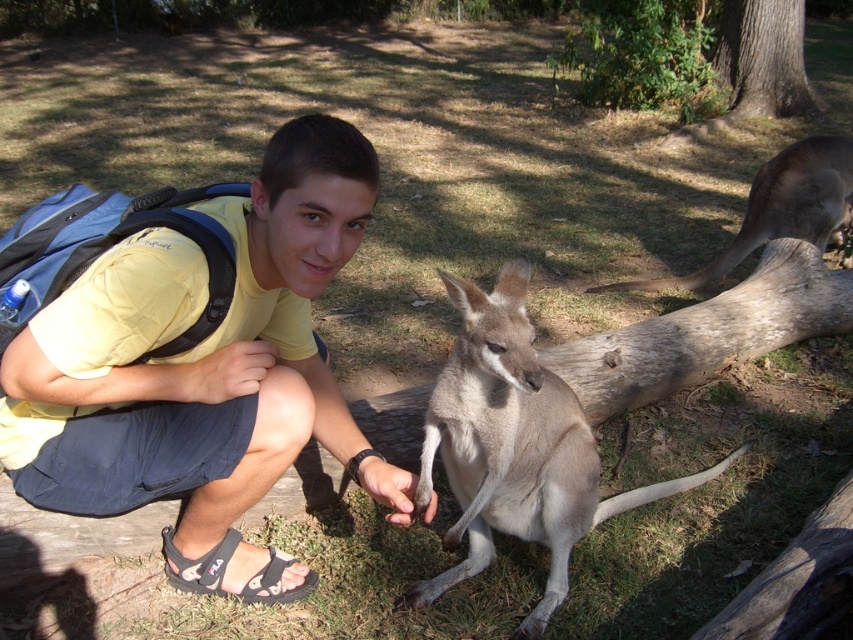
Question: Which point is farther to the camera?

Choices:
 (A) yellow fabric shirt at center
 (B) light brown fur at center

Answer: (B)

Question: Which of these objects is positioned closest to the yellow fabric shirt at center?

Choices:
 (A) brown fur at right
 (B) light brown fur at center

Answer: (B)

Question: Can you confirm if yellow fabric shirt at center is positioned below brown fur at right?

Choices:
 (A) yes
 (B) no

Answer: (A)

Question: Considering the real-world distances, which object is closest to the brown fur at right?

Choices:
 (A) yellow fabric shirt at center
 (B) light brown fur at center

Answer: (B)

Question: Is yellow fabric shirt at center further to the viewer compared to light brown fur at center?

Choices:
 (A) no
 (B) yes

Answer: (A)

Question: Can you confirm if yellow fabric shirt at center is positioned above light brown fur at center?

Choices:
 (A) yes
 (B) no

Answer: (A)